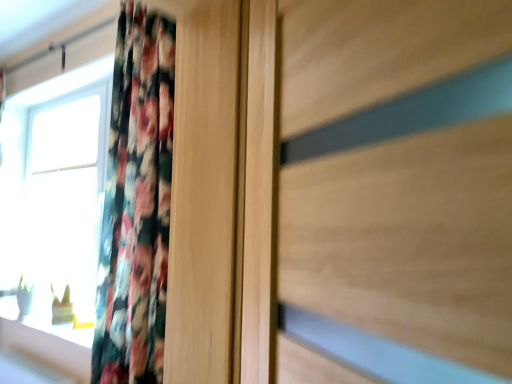
Where is `transparent floral curtain at left`? This screenshot has height=384, width=512. transparent floral curtain at left is located at coordinates (55, 194).

What do you see at coordinates (55, 194) in the screenshot? This screenshot has width=512, height=384. I see `transparent floral curtain at left` at bounding box center [55, 194].

Image resolution: width=512 pixels, height=384 pixels. What are the coordinates of `transparent floral curtain at left` in the screenshot? It's located at (55, 194).